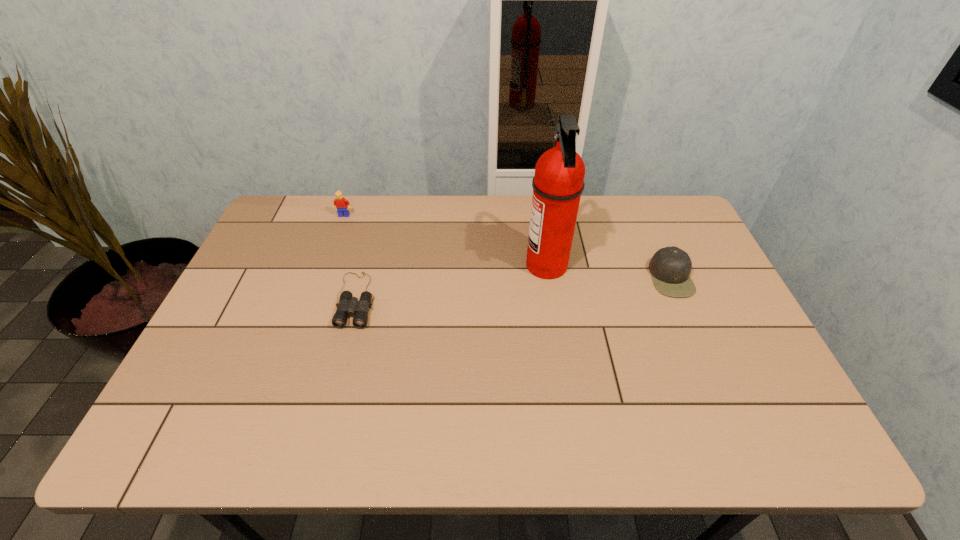
Locate an element on the screen. The height and width of the screenshot is (540, 960). unoccupied area between the second tallest object and the second shortest object is located at coordinates (508, 246).

Locate an element on the screen. free space between the second shortest object and the shortest object is located at coordinates (514, 288).

You are a GUI agent. You are given a task and a screenshot of the screen. Output one action in this format:
    pyautogui.click(x=<x>, y=<y>)
    Task: Click on the free space between the third object from right to left and the tallest object
    
    Given the screenshot: What is the action you would take?
    pyautogui.click(x=451, y=282)

This screenshot has height=540, width=960. Find the location of `free space between the third object from left to right and the Lego`. free space between the third object from left to right and the Lego is located at coordinates (445, 241).

The width and height of the screenshot is (960, 540). Identify the location of object that stands as the third closest to the second object from right to left. (340, 203).

Identify which object is located as the second nearest to the binoculars. Please provide its 2D coordinates. Your answer should be formatted as a tuple, i.e. [(x, y)], where the tuple contains the x and y coordinates of a point satisfying the conditions above.

[(558, 183)]

I want to click on free space that satisfies the following two spatial constraints: 1. on the brim of the cap; 2. at the eyepiece of the third object from right to left, so click(x=680, y=300).

This screenshot has width=960, height=540. I want to click on free space in the image that satisfies the following two spatial constraints: 1. on the side of the tallest object near the handle; 2. at the eyepiece of the second object from left to right, so click(552, 300).

Locate an element on the screen. free space that satisfies the following two spatial constraints: 1. on the brim of the rightmost object; 2. at the eyepiece of the binoculars is located at coordinates (680, 300).

Locate an element on the screen. vacant space that satisfies the following two spatial constraints: 1. on the brim of the rightmost object; 2. at the eyepiece of the second object from left to right is located at coordinates click(x=680, y=300).